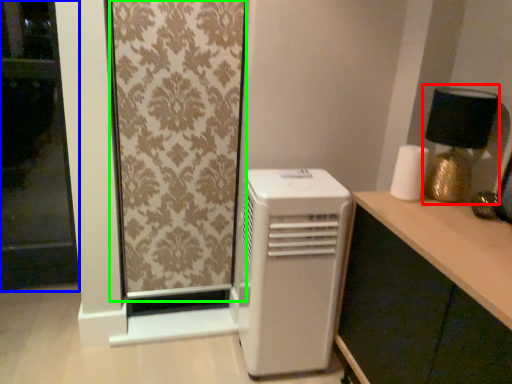
Question: Which is nearer to the table lamp (highlighted by a red box)? screen door (highlighted by a blue box) or curtain (highlighted by a green box).

Choices:
 (A) screen door
 (B) curtain

Answer: (B)